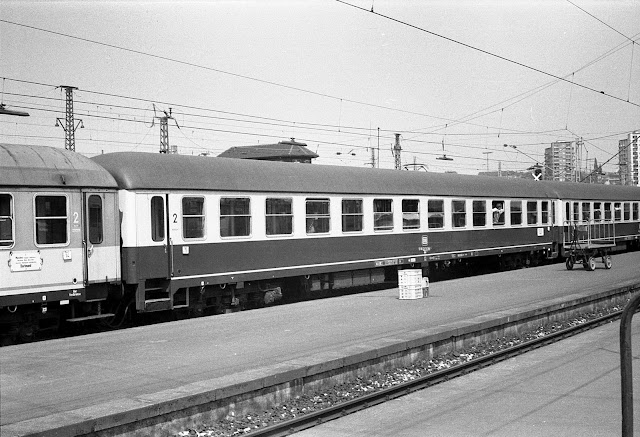
Find the location of a particular element. The width and height of the screenshot is (640, 437). bottom white crate is located at coordinates click(x=402, y=291).